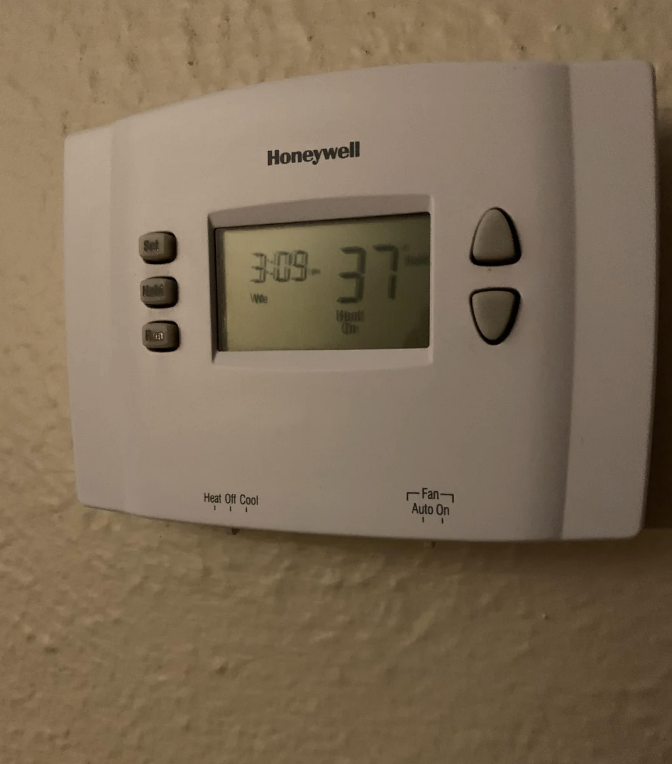
Where is `wall`? This screenshot has height=764, width=672. wall is located at coordinates (236, 681).